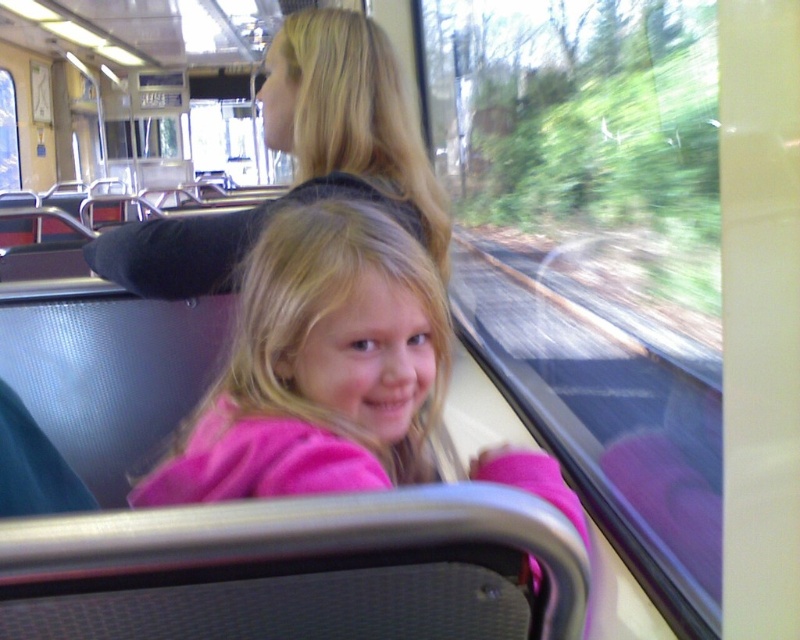
The width and height of the screenshot is (800, 640). In order to click on transparent glass train window at center in this screenshot , I will do `click(594, 250)`.

Does transparent glass train window at center have a larger size compared to pink fleece jacket at center?

Yes.

Does point (536, 124) come behind point (245, 296)?

Yes, it is.

This screenshot has height=640, width=800. I want to click on transparent glass train window at center, so click(x=594, y=250).